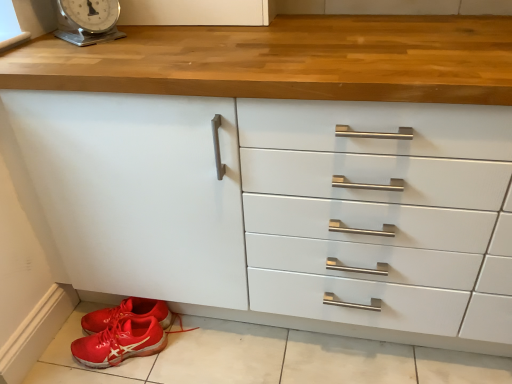
Image resolution: width=512 pixels, height=384 pixels. What do you see at coordinates (126, 313) in the screenshot?
I see `shiny red sneakers at lower left` at bounding box center [126, 313].

This screenshot has height=384, width=512. I want to click on shiny red sneakers at lower left, so click(x=126, y=313).

Which object is wider, shiny red sneakers at lower left or red rubber shoe at lower left?

Wider between the two is red rubber shoe at lower left.

Is shiny red sneakers at lower left further to camera compared to red rubber shoe at lower left?

Yes.

Considering the relative positions of shiny red sneakers at lower left and red rubber shoe at lower left in the image provided, is shiny red sneakers at lower left to the right of red rubber shoe at lower left from the viewer's perspective?

In fact, shiny red sneakers at lower left is to the left of red rubber shoe at lower left.

Who is shorter, red rubber shoe at lower left or shiny red sneakers at lower left?

Standing shorter between the two is shiny red sneakers at lower left.

Is red rubber shoe at lower left facing away from shiny red sneakers at lower left?

Correct, red rubber shoe at lower left is looking away from shiny red sneakers at lower left.

Locate an element on the screen. tile below the shiny red sneakers at lower left (from a real-world perspective) is located at coordinates (68, 339).

Who is smaller, red rubber shoe at lower left or shiny red sneakers at lower left?

With smaller size is shiny red sneakers at lower left.

Is metallic silver scale at upper left wider than red rubber shoe at lower left?

Yes.

From a real-world perspective, is metallic silver scale at upper left positioned under red rubber shoe at lower left based on gravity?

Actually, metallic silver scale at upper left is physically above red rubber shoe at lower left in the real world.

Which object is closer to the camera taking this photo, metallic silver scale at upper left or red rubber shoe at lower left?

Positioned in front is metallic silver scale at upper left.

From the image's perspective, who appears lower, metallic silver scale at upper left or red rubber shoe at lower left?

red rubber shoe at lower left.

Based on the photo, is metallic silver scale at upper left not within shiny red sneakers at lower left?

metallic silver scale at upper left is positioned outside shiny red sneakers at lower left.

From the image's perspective, is metallic silver scale at upper left positioned above or below shiny red sneakers at lower left?

metallic silver scale at upper left is above shiny red sneakers at lower left.

Between metallic silver scale at upper left and shiny red sneakers at lower left, which one has smaller size?

Smaller between the two is shiny red sneakers at lower left.

Consider the image. Measure the distance between metallic silver scale at upper left and shiny red sneakers at lower left.

metallic silver scale at upper left and shiny red sneakers at lower left are 33.72 inches apart from each other.

Is red rubber shoe at lower left smaller than metallic silver scale at upper left?

Actually, red rubber shoe at lower left might be larger than metallic silver scale at upper left.

Locate an element on the screen. The width and height of the screenshot is (512, 384). tile behind the metallic silver scale at upper left is located at coordinates (68, 339).

Considering the relative positions of red rubber shoe at lower left and metallic silver scale at upper left in the image provided, is red rubber shoe at lower left to the left or to the right of metallic silver scale at upper left?

Based on their positions, red rubber shoe at lower left is located to the right of metallic silver scale at upper left.

Is red rubber shoe at lower left aimed at metallic silver scale at upper left?

No, red rubber shoe at lower left is not turned towards metallic silver scale at upper left.

Could you tell me if shiny red sneakers at lower left is turned towards metallic silver scale at upper left?

No, shiny red sneakers at lower left is not aimed at metallic silver scale at upper left.

How different are the orientations of shiny red sneakers at lower left and metallic silver scale at upper left in degrees?

29.4 degrees separate the facing orientations of shiny red sneakers at lower left and metallic silver scale at upper left.

Looking at this image, from the image's perspective, is shiny red sneakers at lower left located beneath metallic silver scale at upper left?

Correct, shiny red sneakers at lower left appears lower than metallic silver scale at upper left in the image.

Between shiny red sneakers at lower left and metallic silver scale at upper left, which one appears on the right side from the viewer's perspective?

→ shiny red sneakers at lower left.

Where is `tile that is in front of the shiny red sneakers at lower left`? The image size is (512, 384). tile that is in front of the shiny red sneakers at lower left is located at coordinates (68, 339).

You are a GUI agent. You are given a task and a screenshot of the screen. Output one action in this format:
    pyautogui.click(x=<x>, y=<y>)
    Task: Click on the footwear located above the red rubber shoe at lower left (from the image's perspective)
    
    Given the screenshot: What is the action you would take?
    pyautogui.click(x=126, y=313)

When comparing their distances from red rubber shoe at lower left, does shiny red sneakers at lower left or metallic silver scale at upper left seem further?

Based on the image, metallic silver scale at upper left appears to be further to red rubber shoe at lower left.

Based on their spatial positions, is metallic silver scale at upper left or red rubber shoe at lower left closer to shiny red sneakers at lower left?

red rubber shoe at lower left.

Looking at the image, which one is located further to metallic silver scale at upper left, shiny red sneakers at lower left or red rubber shoe at lower left?

Based on the image, red rubber shoe at lower left appears to be further to metallic silver scale at upper left.

Based on their spatial positions, is metallic silver scale at upper left or shiny red sneakers at lower left closer to red rubber shoe at lower left?

shiny red sneakers at lower left lies closer to red rubber shoe at lower left than the other object.

Looking at the image, which one is located closer to metallic silver scale at upper left, red rubber shoe at lower left or shiny red sneakers at lower left?

shiny red sneakers at lower left.

From the image, which object appears to be nearer to shiny red sneakers at lower left, red rubber shoe at lower left or metallic silver scale at upper left?

Among the two, red rubber shoe at lower left is located nearer to shiny red sneakers at lower left.

At what (x,y) coordinates should I click in order to perform the action: click on footwear between metallic silver scale at upper left and red rubber shoe at lower left in the up-down direction. Please return your answer as a coordinate pair (x, y). The image size is (512, 384). Looking at the image, I should click on (126, 313).